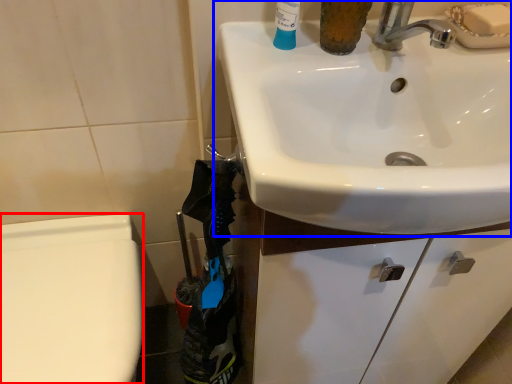
Question: Which point is closer to the camera, bidet (highlighted by a red box) or sink (highlighted by a blue box)?

Choices:
 (A) bidet
 (B) sink

Answer: (B)